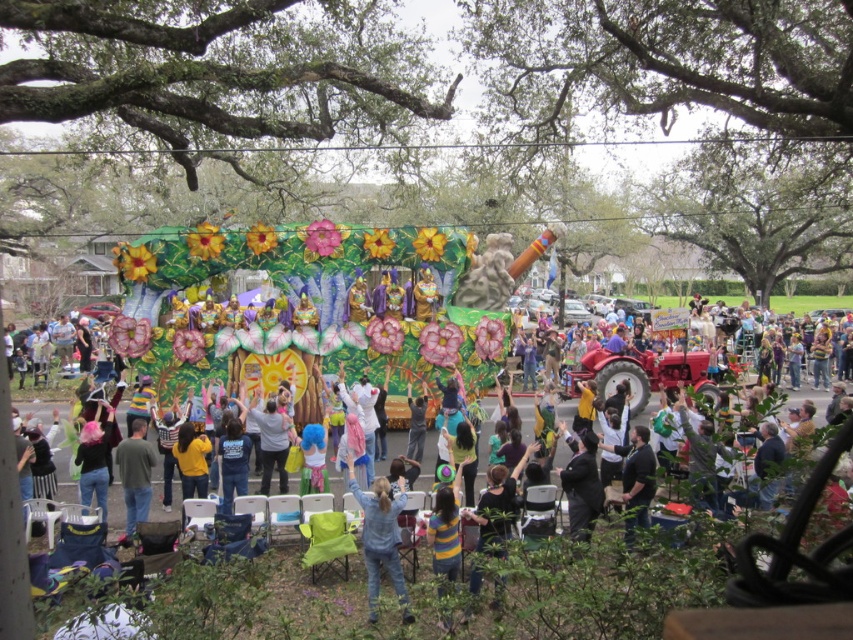
Can you confirm if denim jacket at center is positioned below gray cotton shirt at lower left?

Correct, denim jacket at center is located below gray cotton shirt at lower left.

Does denim jacket at center have a greater height compared to gray cotton shirt at lower left?

Yes, denim jacket at center is taller than gray cotton shirt at lower left.

Between point (396, 576) and point (135, 454), which one is positioned behind?

The point (135, 454) is behind.

You are a GUI agent. You are given a task and a screenshot of the screen. Output one action in this format:
    pyautogui.click(x=<x>, y=<y>)
    Task: Click on the denim jacket at center
    
    Given the screenshot: What is the action you would take?
    pyautogui.click(x=380, y=538)